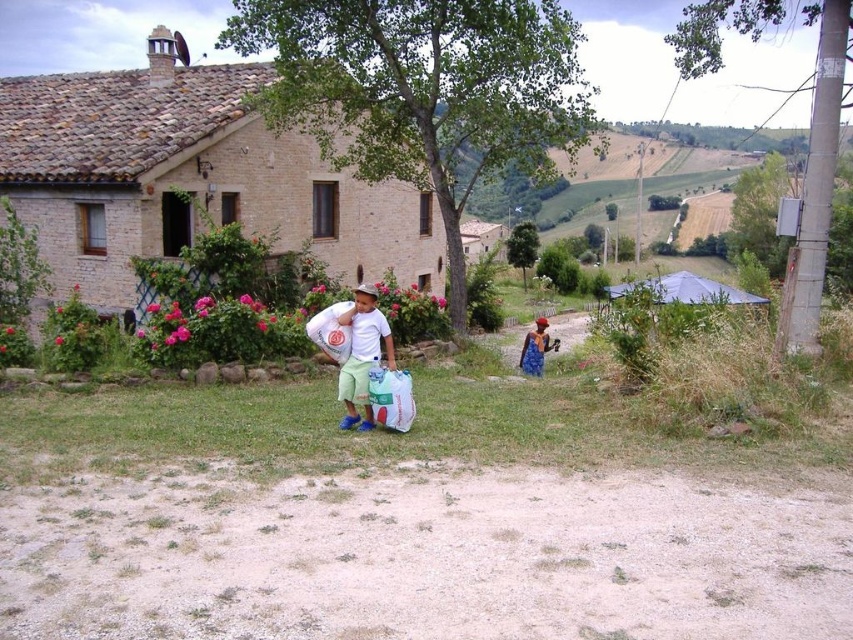
You are a photographer trying to capture the scene with the white matte shirt at center and the blue denim dress at lower right. Which object should you focus on first if you want to include both in your shot without moving the camera?

You should focus on the white matte shirt at center first because it is positioned to the left of the blue denim dress at lower right, so capturing it first ensures both are in frame.

The scene shows a young child walking along a dirt path towards a rustic house surrounded by greenery. The child is wearing a white shirt, light green shorts, blue shoes, and a hat. There is a point marked at coordinates (x=363, y=355). What object is located at this point?

The object located at point (x=363, y=355) is the white matte shirt at center.